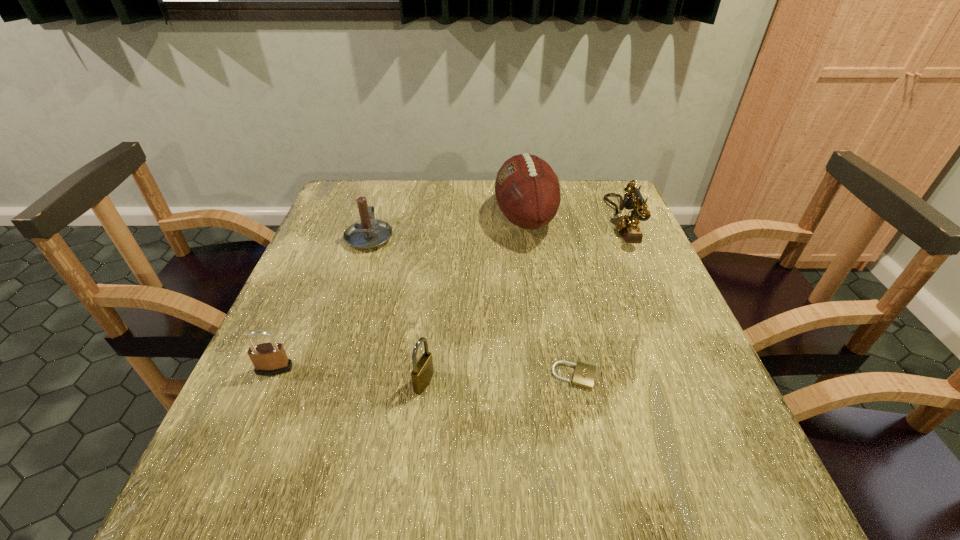
Locate an element on the screen. This screenshot has width=960, height=540. the tallest object is located at coordinates (527, 190).

Image resolution: width=960 pixels, height=540 pixels. Identify the location of the rightmost object. (628, 225).

Where is `candle`? candle is located at coordinates (367, 233).

Locate an element on the screen. Image resolution: width=960 pixels, height=540 pixels. the second padlock from right to left is located at coordinates (422, 373).

Identify the location of the leftmost padlock. (269, 359).

The image size is (960, 540). What are the coordinates of `the shortest object` in the screenshot? It's located at (584, 375).

Identify the location of the rightmost padlock. Image resolution: width=960 pixels, height=540 pixels. (584, 375).

At what (x,y) coordinates should I click in order to perform the action: click on free space located 0.320m on the left of the football (American). Please return your answer as a coordinate pair (x, y). This screenshot has width=960, height=540. Looking at the image, I should click on (381, 218).

You are a GUI agent. You are given a task and a screenshot of the screen. Output one action in this format:
    pyautogui.click(x=<x>, y=<y>)
    Task: Click on the free space located on the front-facing side of the rightmost object
    The width and height of the screenshot is (960, 540).
    Given the screenshot: What is the action you would take?
    pyautogui.click(x=515, y=220)

You are a GUI agent. You are given a task and a screenshot of the screen. Output one action in this format:
    pyautogui.click(x=<x>, y=<y>)
    Task: Click on the blank area located 0.140m on the front-facing side of the rightmost object
    The height and width of the screenshot is (540, 960).
    Given the screenshot: What is the action you would take?
    pyautogui.click(x=561, y=220)